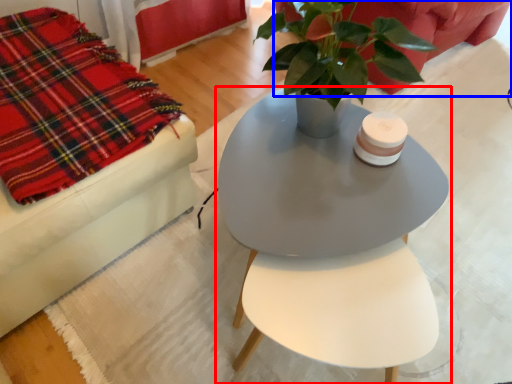
Question: Which object is further to the camera taking this photo, table (highlighted by a red box) or couch (highlighted by a blue box)?

Choices:
 (A) table
 (B) couch

Answer: (B)